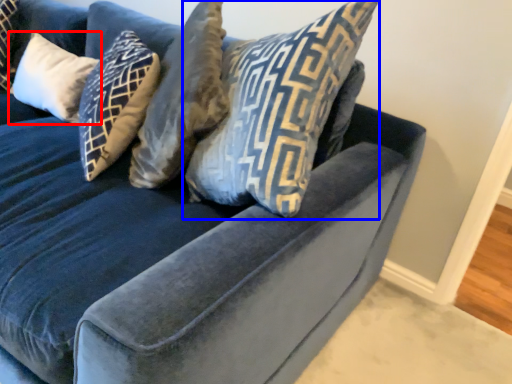
Question: Among these objects, which one is nearest to the camera, pillow (highlighted by a red box) or pillow (highlighted by a blue box)?

Choices:
 (A) pillow
 (B) pillow

Answer: (B)